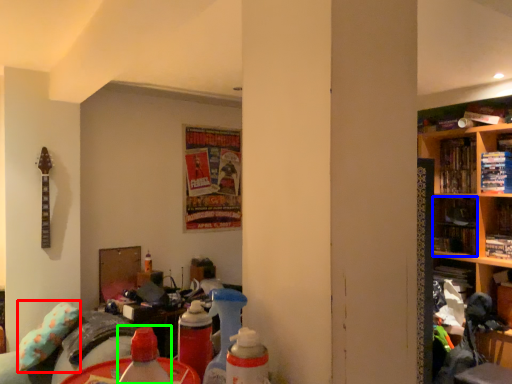
Question: Which is farther away from pillow (highlighted by a red box)? book (highlighted by a blue box) or bottle (highlighted by a green box)?

Choices:
 (A) book
 (B) bottle

Answer: (A)